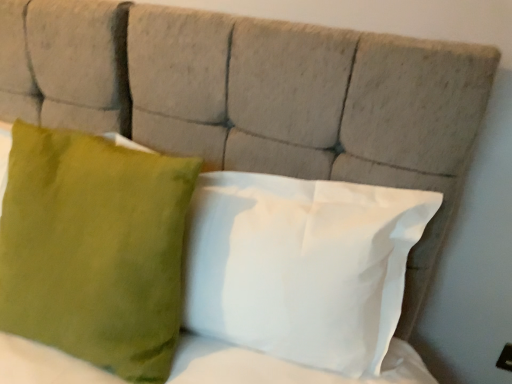
Question: Does green velvet pillow at left, which ranks as the first pillow in left-to-right order, have a larger size compared to white matte pillow at center, which is the 2th pillow from left to right?

Choices:
 (A) yes
 (B) no

Answer: (A)

Question: Can you confirm if green velvet pillow at left, which ranks as the first pillow in left-to-right order, is smaller than white matte pillow at center, which is the 2th pillow from left to right?

Choices:
 (A) yes
 (B) no

Answer: (B)

Question: From a real-world perspective, is green velvet pillow at left, which appears as the second pillow when viewed from the right, located beneath white matte pillow at center, which is the 2th pillow from left to right?

Choices:
 (A) yes
 (B) no

Answer: (A)

Question: Is green velvet pillow at left, which ranks as the first pillow in left-to-right order, at the left side of white matte pillow at center, acting as the 1th pillow starting from the right?

Choices:
 (A) yes
 (B) no

Answer: (A)

Question: Is green velvet pillow at left, which appears as the second pillow when viewed from the right, next to white matte pillow at center, which is the 2th pillow from left to right?

Choices:
 (A) no
 (B) yes

Answer: (A)

Question: Considering the relative sizes of green velvet pillow at left, which appears as the second pillow when viewed from the right, and white matte pillow at center, acting as the 1th pillow starting from the right, in the image provided, is green velvet pillow at left, which appears as the second pillow when viewed from the right, thinner than white matte pillow at center, acting as the 1th pillow starting from the right,?

Choices:
 (A) yes
 (B) no

Answer: (B)

Question: Does white matte pillow at center, acting as the 1th pillow starting from the right, lie behind green velvet pillow at left, which appears as the second pillow when viewed from the right?

Choices:
 (A) no
 (B) yes

Answer: (B)

Question: Is white matte pillow at center, which is the 2th pillow from left to right, facing away from green velvet pillow at left, which ranks as the first pillow in left-to-right order?

Choices:
 (A) yes
 (B) no

Answer: (B)

Question: Considering the relative sizes of white matte pillow at center, acting as the 1th pillow starting from the right, and green velvet pillow at left, which ranks as the first pillow in left-to-right order, in the image provided, is white matte pillow at center, acting as the 1th pillow starting from the right, smaller than green velvet pillow at left, which ranks as the first pillow in left-to-right order,?

Choices:
 (A) yes
 (B) no

Answer: (A)

Question: Is white matte pillow at center, acting as the 1th pillow starting from the right, at the right side of green velvet pillow at left, which ranks as the first pillow in left-to-right order?

Choices:
 (A) no
 (B) yes

Answer: (B)

Question: From a real-world perspective, is white matte pillow at center, acting as the 1th pillow starting from the right, below green velvet pillow at left, which appears as the second pillow when viewed from the right?

Choices:
 (A) no
 (B) yes

Answer: (A)

Question: Is white matte pillow at center, which is the 2th pillow from left to right, taller than green velvet pillow at left, which appears as the second pillow when viewed from the right?

Choices:
 (A) yes
 (B) no

Answer: (B)

Question: Relative to white matte pillow at center, acting as the 1th pillow starting from the right, is green velvet pillow at left, which appears as the second pillow when viewed from the right, in front or behind?

Choices:
 (A) front
 (B) behind

Answer: (A)